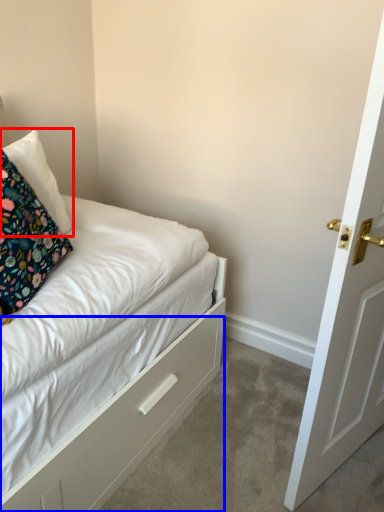
Question: Which point is further to the camera, pillow (highlighted by a red box) or drawer (highlighted by a blue box)?

Choices:
 (A) pillow
 (B) drawer

Answer: (A)